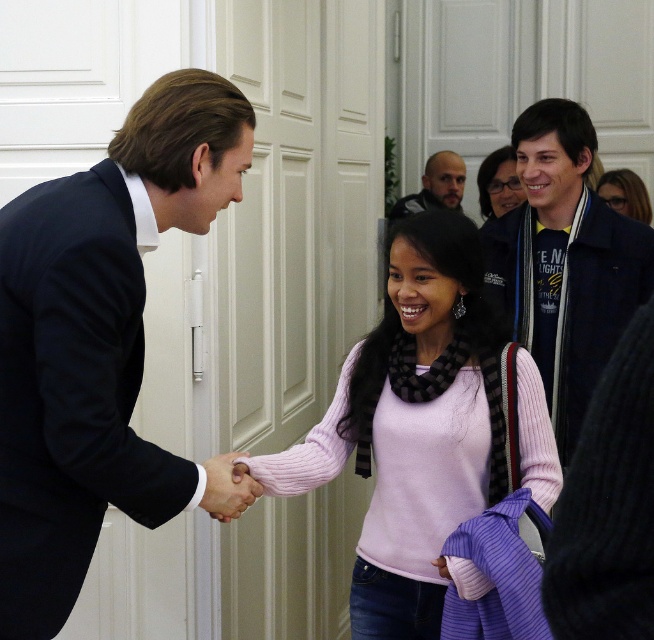
Question: Which object is positioned closest to the matte black hair at upper right?

Choices:
 (A) pink sweater at center
 (B) pink ribbed sweater at center

Answer: (A)

Question: From the image, what is the correct spatial relationship of pink ribbed sweater at center in relation to pink sweater at center?

Choices:
 (A) right
 (B) left

Answer: (B)

Question: Which point is farther to the camera?

Choices:
 (A) (528, 161)
 (B) (383, 632)
 (C) (228, 476)

Answer: (A)

Question: Which of the following is the closest to the observer?

Choices:
 (A) (445, 196)
 (B) (101, 260)
 (C) (638, 192)
 (D) (373, 458)

Answer: (B)

Question: From the image, what is the correct spatial relationship of dark blue jacket at upper right in relation to smooth leather hand at center?

Choices:
 (A) below
 (B) above

Answer: (B)

Question: Can you confirm if black suit at left is positioned below pink ribbed sweater at center?

Choices:
 (A) no
 (B) yes

Answer: (A)